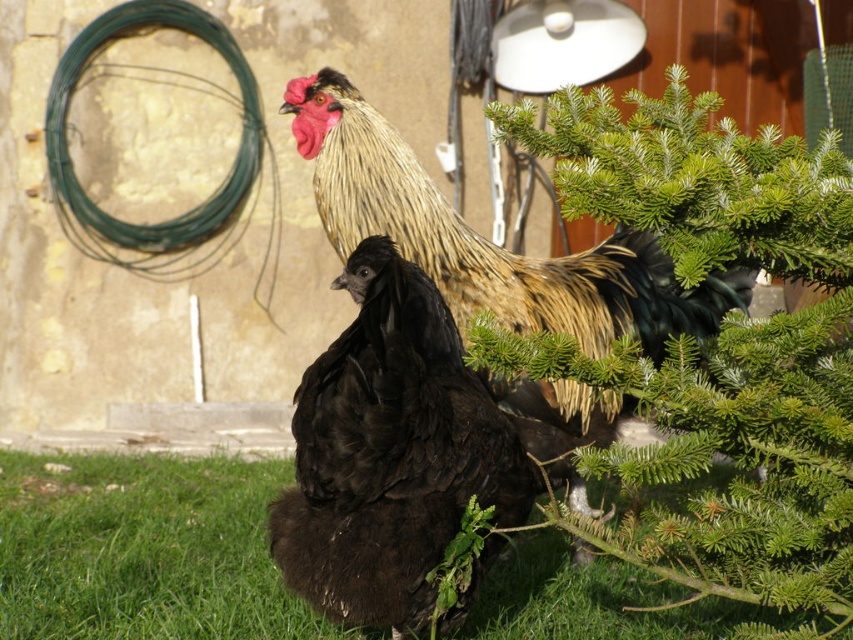
Question: Is black feathered chicken at center in front of black feathered rooster at center?

Choices:
 (A) no
 (B) yes

Answer: (B)

Question: Which point is farther from the camera taking this photo?

Choices:
 (A) (532, 445)
 (B) (737, 396)
 (C) (659, 595)

Answer: (C)

Question: Is black feathered chicken at center smaller than black feathered rooster at center?

Choices:
 (A) yes
 (B) no

Answer: (A)

Question: Does green needle-like leaves at center right appear on the left side of black feathered chicken at center?

Choices:
 (A) yes
 (B) no

Answer: (B)

Question: Which point appears farthest from the camera in this image?

Choices:
 (A) (18, 477)
 (B) (492, 305)
 (C) (402, 435)

Answer: (A)

Question: Considering the real-world distances, which object is closest to the green needle-like leaves at center right?

Choices:
 (A) black feathered chicken at center
 (B) green soft grass at lower left
 (C) black feathered rooster at center

Answer: (A)